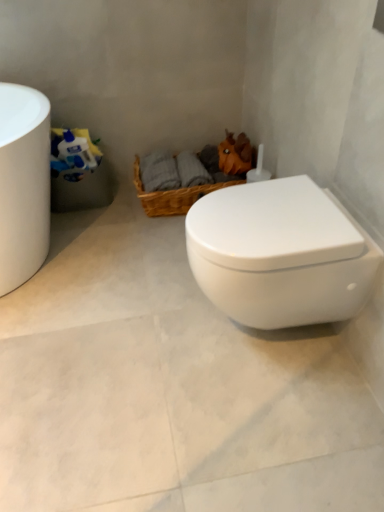
Locate an element on the screen. This screenshot has height=512, width=384. vacant region under white glossy toilet at center (from a real-world perspective) is located at coordinates (261, 340).